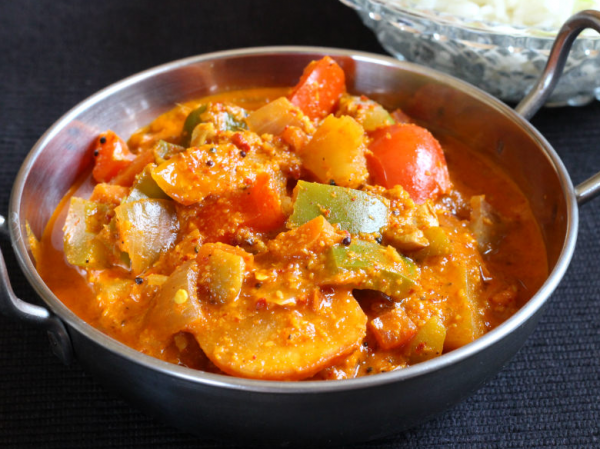
Locate an element on the screen. table cloth is located at coordinates (553, 365).